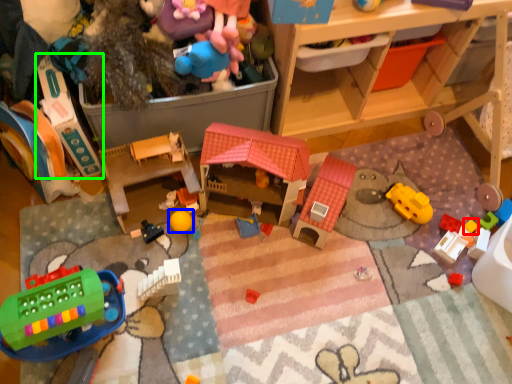
Question: Which is nearer to the toy (highlighted by a red box)? toy (highlighted by a blue box) or toy (highlighted by a green box).

Choices:
 (A) toy
 (B) toy

Answer: (A)